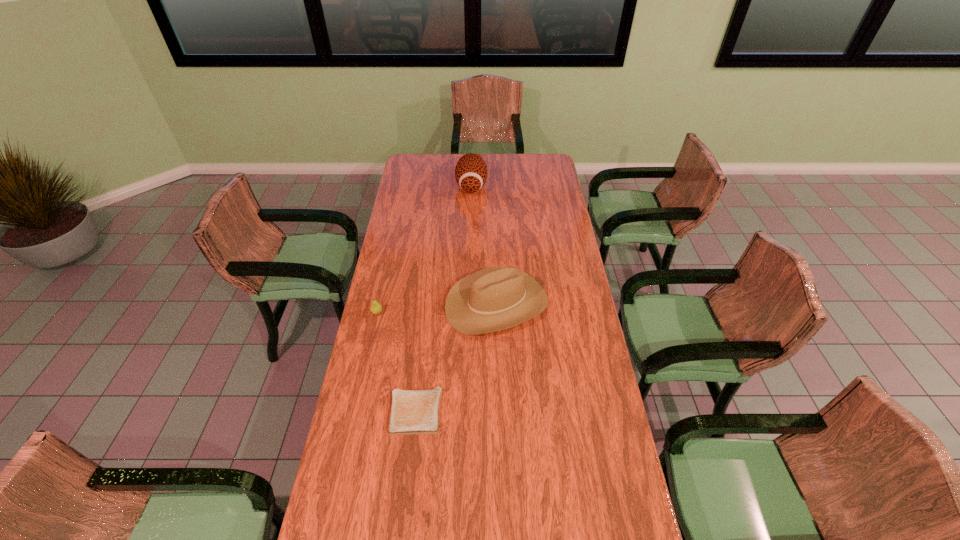
Find the location of a particular element. free space between the second shortest object and the cowboy hat is located at coordinates (437, 308).

Where is `free space between the farthest object and the cowboy hat`? The width and height of the screenshot is (960, 540). free space between the farthest object and the cowboy hat is located at coordinates (484, 245).

Where is `vacant region between the cowboy hat and the football`? vacant region between the cowboy hat and the football is located at coordinates (484, 245).

I want to click on free point between the toast and the cowboy hat, so click(x=456, y=357).

Image resolution: width=960 pixels, height=540 pixels. I want to click on free point between the shortest object and the cowboy hat, so click(x=456, y=357).

Locate an element on the screen. vacant area that lies between the third tallest object and the farthest object is located at coordinates (424, 249).

You are a GUI agent. You are given a task and a screenshot of the screen. Output one action in this format:
    pyautogui.click(x=<x>, y=<y>)
    Task: Click on the blank region between the farthest object and the shortest object
    Image resolution: width=960 pixels, height=540 pixels.
    Given the screenshot: What is the action you would take?
    (x=444, y=299)

Find the location of a particular element. This screenshot has height=540, width=960. vacant area that lies between the leftmost object and the cowboy hat is located at coordinates (437, 308).

Where is `empty location between the cowboy hat and the nearest object`? empty location between the cowboy hat and the nearest object is located at coordinates (x=456, y=357).

Identify the location of the closest object relative to the farthest object. Image resolution: width=960 pixels, height=540 pixels. (496, 298).